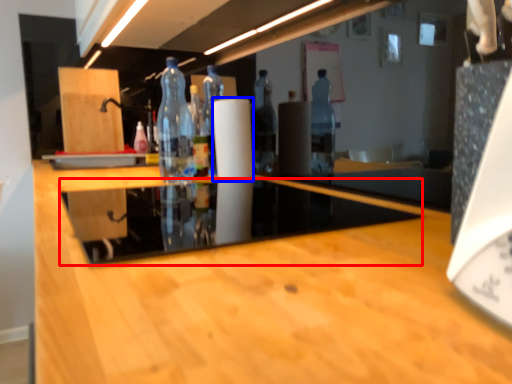
Question: Among these objects, which one is nearest to the camera, glass table (highlighted by a red box) or paper towel (highlighted by a blue box)?

Choices:
 (A) glass table
 (B) paper towel

Answer: (A)